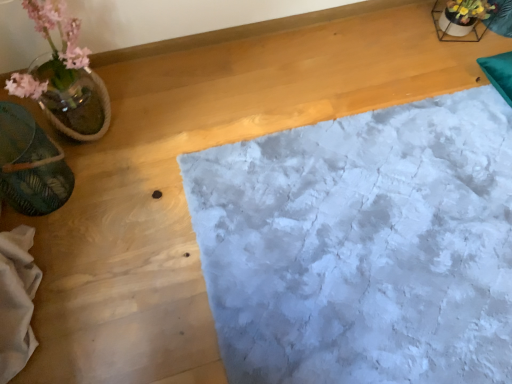
The height and width of the screenshot is (384, 512). What are the coordinates of `vacant region to the right of translucent glass vase at left` in the screenshot? It's located at (154, 159).